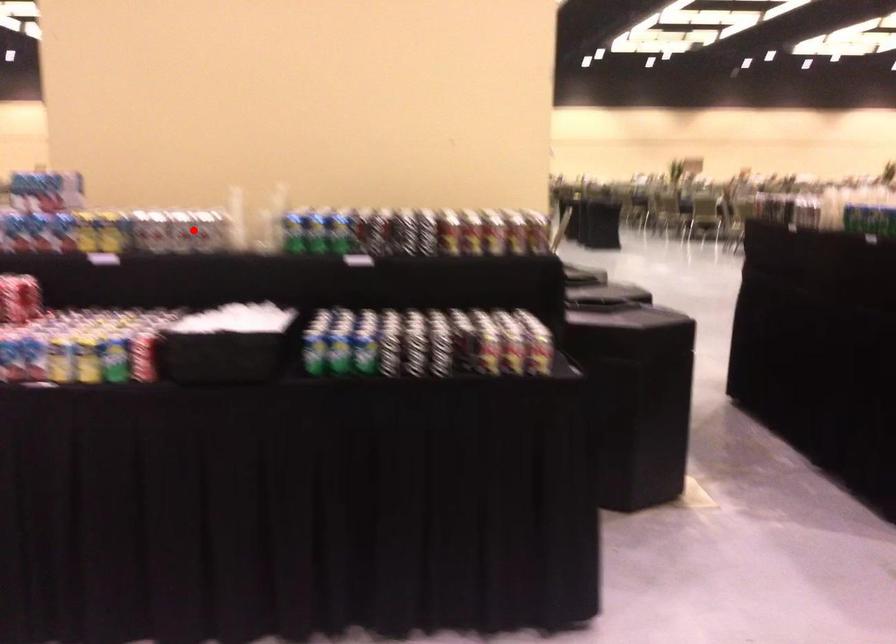
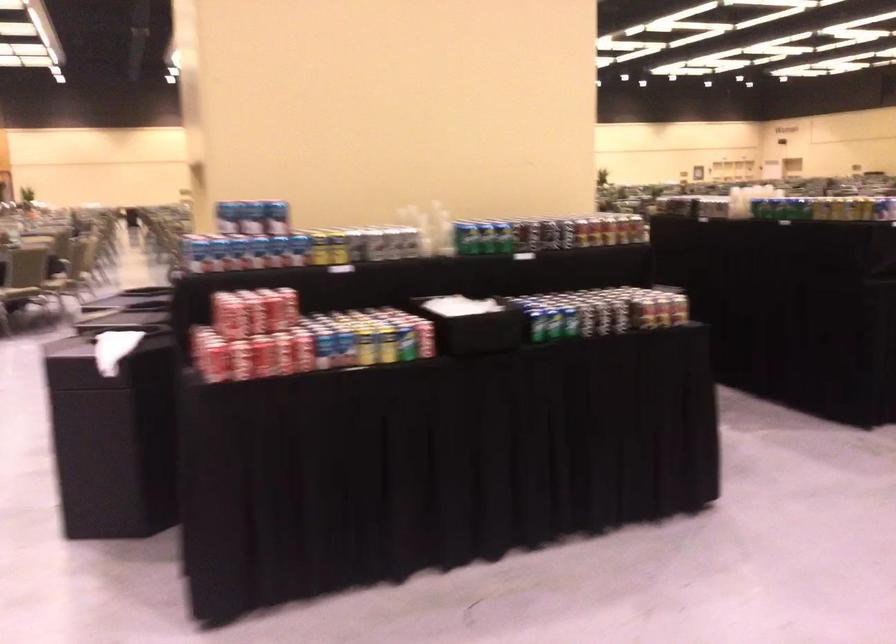
Find the pixel in the second image that matches the highlighted location in the first image.

(395, 242)